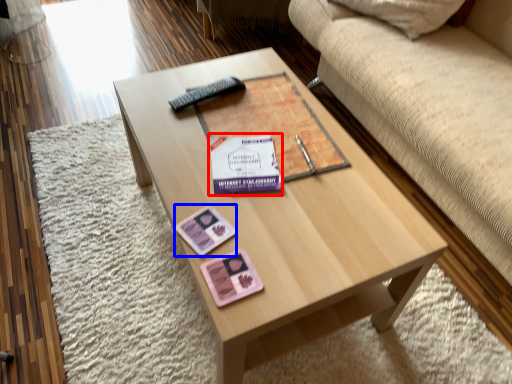
Question: Which object appears closest to the camera in this image, paperback book (highlighted by a red box) or currency (highlighted by a blue box)?

Choices:
 (A) paperback book
 (B) currency

Answer: (B)